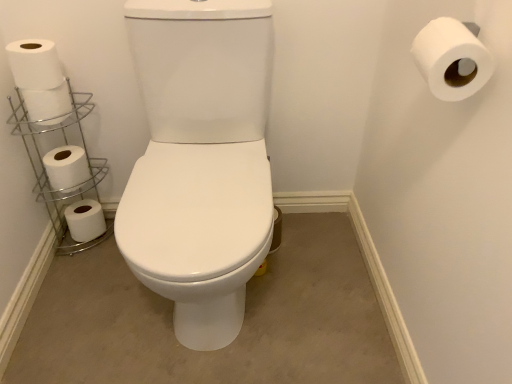
Question: Considering the relative sizes of white matte toilet paper at left, which appears as the fourth toilet paper when viewed from the left, and white matte toilet paper at upper right, positioned as the 5th toilet paper in back-to-front order, in the image provided, is white matte toilet paper at left, which appears as the fourth toilet paper when viewed from the left, bigger than white matte toilet paper at upper right, positioned as the 5th toilet paper in back-to-front order,?

Choices:
 (A) no
 (B) yes

Answer: (B)

Question: Does white matte toilet paper at left, which appears as the 4th toilet paper when viewed from the back, have a greater width compared to white matte toilet paper at upper right, the fifth toilet paper viewed from the left?

Choices:
 (A) no
 (B) yes

Answer: (A)

Question: Is white matte toilet paper at left, which is the second toilet paper from right to left, at the right side of white matte toilet paper at upper right, positioned as the 5th toilet paper in back-to-front order?

Choices:
 (A) no
 (B) yes

Answer: (A)

Question: Is white matte toilet paper at left, which appears as the fourth toilet paper when viewed from the left, completely or partially outside of white matte toilet paper at upper right, positioned as the 5th toilet paper in back-to-front order?

Choices:
 (A) no
 (B) yes

Answer: (B)

Question: Is white matte toilet paper at left, which is the second toilet paper from right to left, shorter than white matte toilet paper at upper right, positioned as the 5th toilet paper in back-to-front order?

Choices:
 (A) no
 (B) yes

Answer: (B)

Question: In terms of size, does white matte toilet paper at lower left, the first toilet paper from the left, appear bigger or smaller than white matte toilet paper at left, which is the second toilet paper from back to front?

Choices:
 (A) small
 (B) big

Answer: (A)

Question: Relative to white matte toilet paper at left, the 4th toilet paper from the front, is white matte toilet paper at lower left, the 1th toilet paper viewed from the back, in front or behind?

Choices:
 (A) front
 (B) behind

Answer: (B)

Question: Considering the positions of white matte toilet paper at lower left, the 5th toilet paper when ordered from front to back, and white matte toilet paper at left, which appears as the 4th toilet paper when viewed from the right, in the image, is white matte toilet paper at lower left, the 5th toilet paper when ordered from front to back, taller or shorter than white matte toilet paper at left, which appears as the 4th toilet paper when viewed from the right,?

Choices:
 (A) tall
 (B) short

Answer: (B)

Question: Is point (72, 210) positioned closer to the camera than point (62, 178)?

Choices:
 (A) farther
 (B) closer

Answer: (A)

Question: Relative to white matte toilet paper at lower left, the first toilet paper from the left, is silver/metallic toilet paper holder at left in front or behind?

Choices:
 (A) front
 (B) behind

Answer: (A)

Question: From the image's perspective, is silver/metallic toilet paper holder at left positioned above or below white matte toilet paper at lower left, marked as the fifth toilet paper in a right-to-left arrangement?

Choices:
 (A) below
 (B) above

Answer: (B)

Question: Is silver/metallic toilet paper holder at left bigger or smaller than white matte toilet paper at lower left, the 5th toilet paper when ordered from front to back?

Choices:
 (A) small
 (B) big

Answer: (B)

Question: In the image, is silver/metallic toilet paper holder at left on the left side or the right side of white matte toilet paper at lower left, the first toilet paper from the left?

Choices:
 (A) left
 (B) right

Answer: (B)

Question: From a real-world perspective, is white matte toilet paper at lower left, the 1th toilet paper viewed from the back, physically located above or below silver/metallic toilet paper holder at left?

Choices:
 (A) below
 (B) above

Answer: (A)

Question: Does point (81, 210) appear closer or farther from the camera than point (33, 170)?

Choices:
 (A) closer
 (B) farther

Answer: (B)